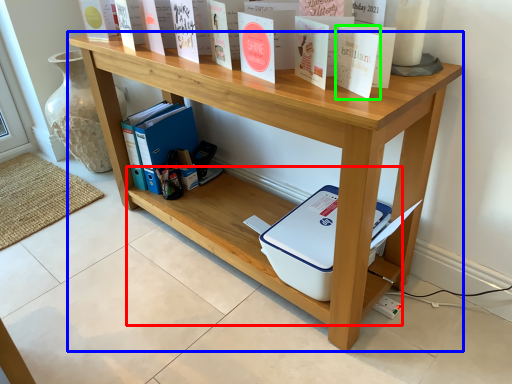
Question: Considering the real-world distances, which object is closest to shelf (highlighted by a red box)? shelf (highlighted by a blue box) or paperback book (highlighted by a green box).

Choices:
 (A) shelf
 (B) paperback book

Answer: (A)